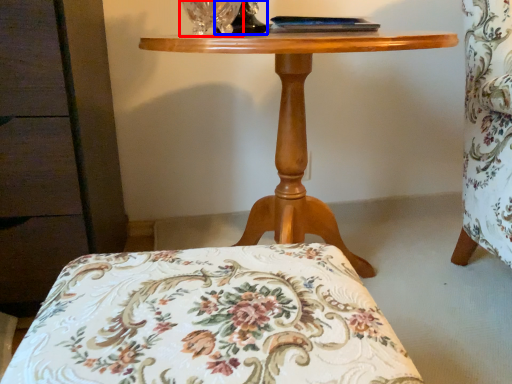
Question: Which point is closer to the camera, glass vase (highlighted by a red box) or table lamp (highlighted by a blue box)?

Choices:
 (A) glass vase
 (B) table lamp

Answer: (A)